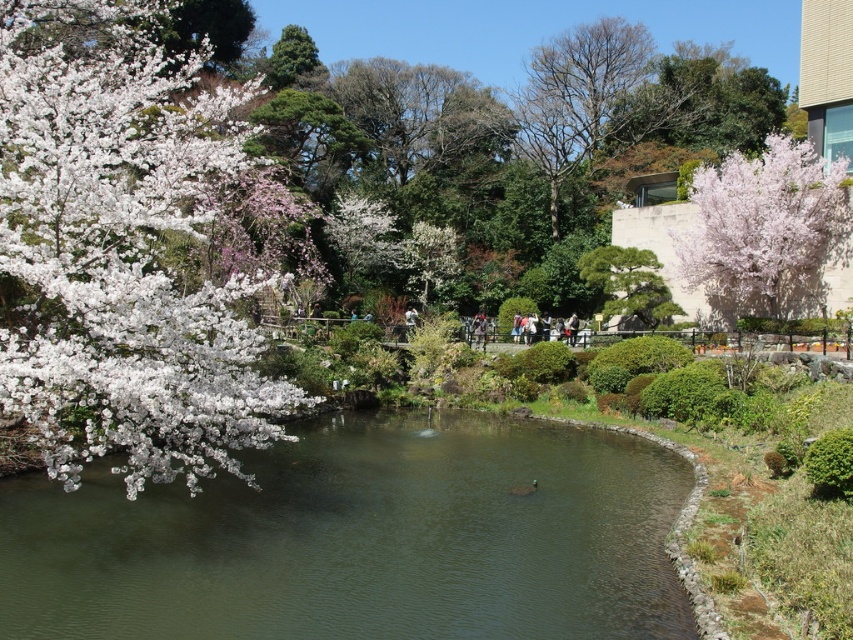
Is point (743, 272) positioned before point (585, 266)?

That is True.

Which is more to the right, slightly glossy pink blossoms at upper right or green textured bonsai tree at center?

Positioned to the right is slightly glossy pink blossoms at upper right.

Is point (784, 307) farther from camera compared to point (625, 294)?

No, (784, 307) is in front of (625, 294).

Locate an element on the screen. slightly glossy pink blossoms at upper right is located at coordinates (766, 228).

Is green smooth water at center smaller than green textured bonsai tree at center?

Actually, green smooth water at center might be larger than green textured bonsai tree at center.

Between green smooth water at center and green textured bonsai tree at center, which one appears on the left side from the viewer's perspective?

green smooth water at center is more to the left.

Identify the location of green smooth water at center. This screenshot has width=853, height=640. (363, 540).

Can you confirm if green smooth water at center is taller than slightly glossy pink blossoms at upper right?

No, green smooth water at center is not taller than slightly glossy pink blossoms at upper right.

Does green smooth water at center appear on the right side of slightly glossy pink blossoms at upper right?

No, green smooth water at center is not to the right of slightly glossy pink blossoms at upper right.

The image size is (853, 640). Identify the location of green smooth water at center. (363, 540).